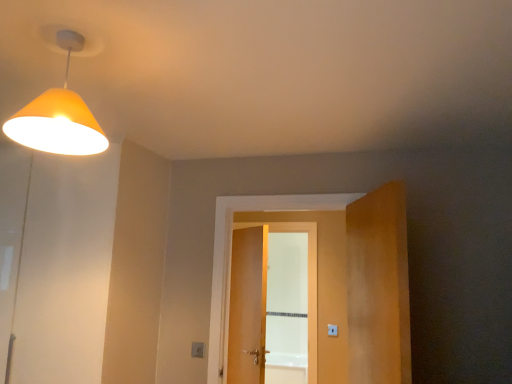
Question: Is orange matte lampshade at upper left wider or thinner than wooden door at center?

Choices:
 (A) thin
 (B) wide

Answer: (B)

Question: Looking at the image, does orange matte lampshade at upper left seem bigger or smaller compared to wooden door at center?

Choices:
 (A) big
 (B) small

Answer: (B)

Question: Which object is positioned closest to the white plastic light switch at lower center?

Choices:
 (A) orange matte lampshade at upper left
 (B) wooden door at center

Answer: (B)

Question: Estimate the real-world distances between objects in this image. Which object is farther from the wooden door at center?

Choices:
 (A) white plastic light switch at lower center
 (B) orange matte lampshade at upper left

Answer: (B)